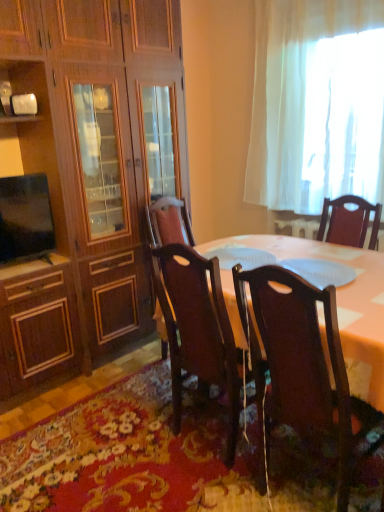
Locate an element on the screen. This screenshot has height=512, width=384. vacant area to the left of polished dark wood chair at center, the 2th chair in the right-to-left sequence is located at coordinates (131, 447).